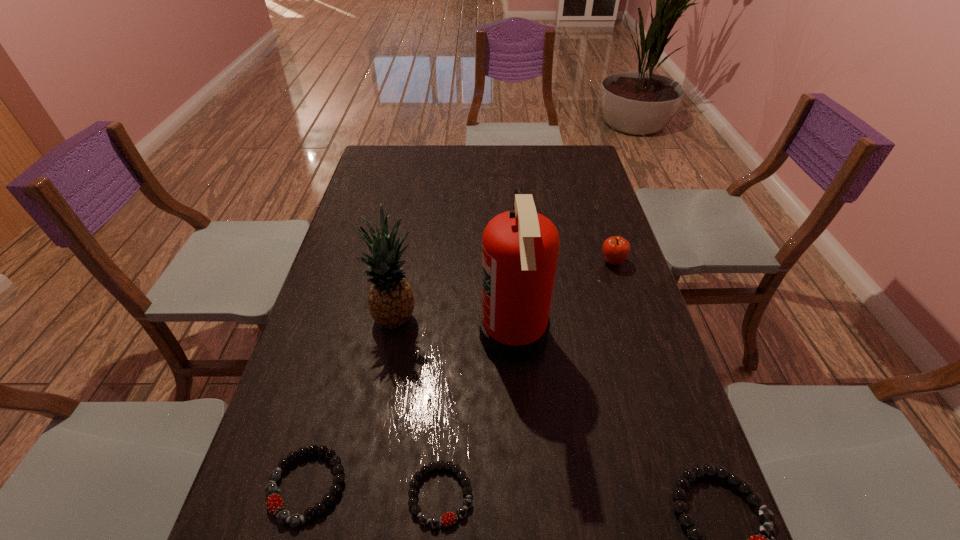
Where is `empty location between the fire extinguisher and the shortest bracelet`? The image size is (960, 540). empty location between the fire extinguisher and the shortest bracelet is located at coordinates coord(477,415).

Locate an element on the screen. free space between the leftmost bracelet and the apple is located at coordinates (460, 374).

In order to click on free space between the second tallest bracelet and the shortest object in this screenshot , I will do `click(373, 490)`.

Find the location of a particular element. empty space between the fourth object from left to right and the pineapple is located at coordinates (455, 326).

Find the location of `the second closest object to the second bracelet from left to right`. the second closest object to the second bracelet from left to right is located at coordinates (520, 248).

Locate which object ranks second in proximity to the leftmost bracelet. Please provide its 2D coordinates. Your answer should be formatted as a tuple, i.e. [(x, y)], where the tuple contains the x and y coordinates of a point satisfying the conditions above.

[(391, 301)]

Select which bracelet is the closest to the second tallest bracelet. Please provide its 2D coordinates. Your answer should be formatted as a tuple, i.e. [(x, y)], where the tuple contains the x and y coordinates of a point satisfying the conditions above.

[(449, 518)]

You are a GUI agent. You are given a task and a screenshot of the screen. Output one action in this format:
    pyautogui.click(x=<x>, y=<y>)
    Task: Click on the bracelet that is the second closest to the leftmost bracelet
    
    Given the screenshot: What is the action you would take?
    pyautogui.click(x=766, y=539)